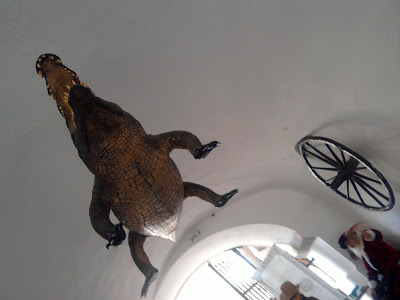
Identify the location of rim of wagonwheel mounted on wall on right. (368, 163), (324, 181), (326, 140), (387, 207).